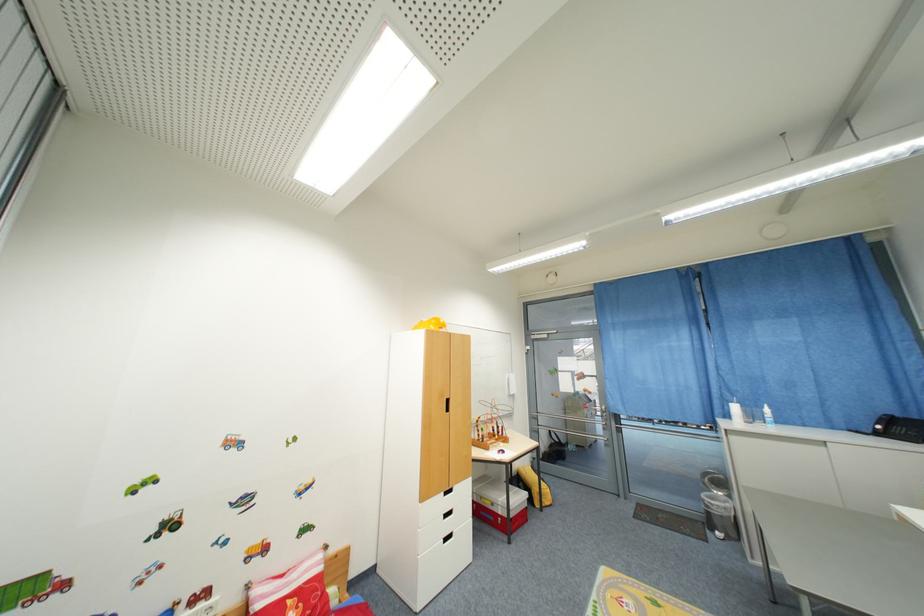
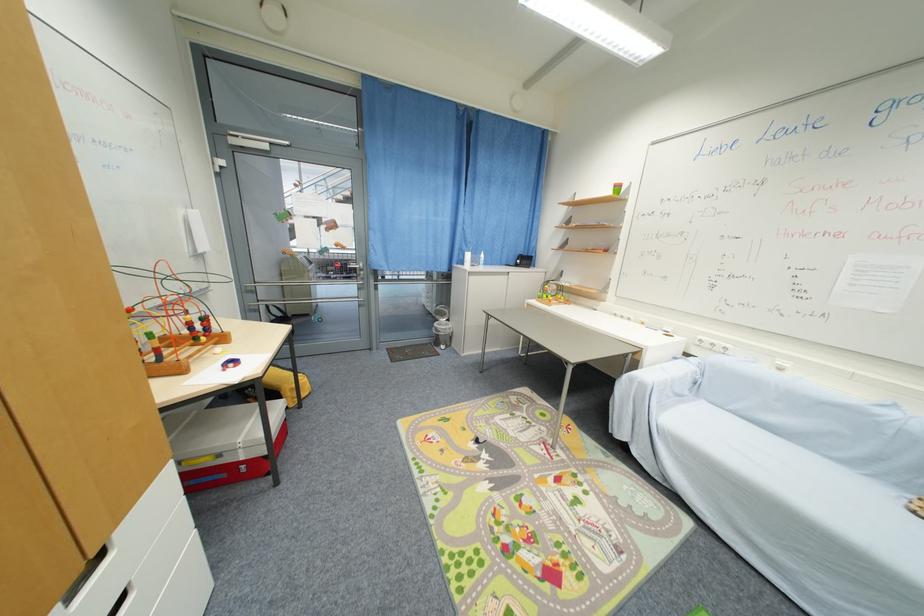
Question: I am providing you with two images of the same scene from different viewpoints. Please identify which objects are invisible in image2.

Choices:
 (A) oval mirror
 (B) metal door handle
 (C) small mesh trashcan
 (D) red box handle

Answer: (B)